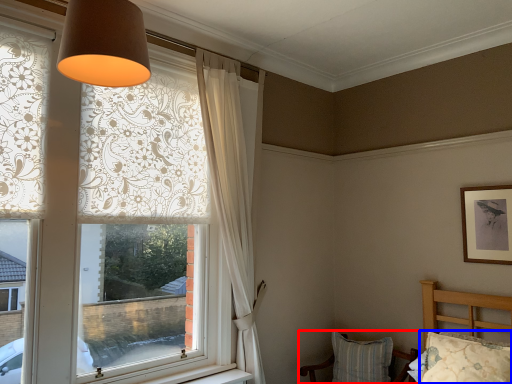
Question: Which of the following is the closest to the observer, chair (highlighted by a red box) or pillow (highlighted by a blue box)?

Choices:
 (A) chair
 (B) pillow

Answer: (B)